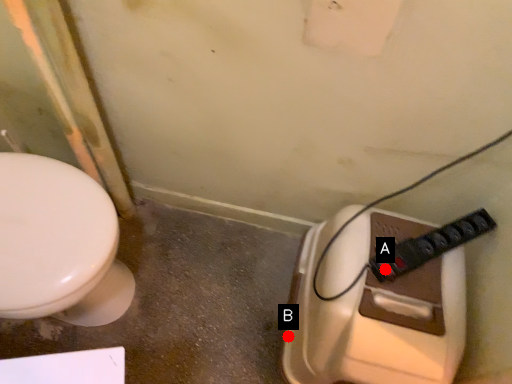
Question: Two points are circled on the image, labeled by A and B beside each circle. Which point is further to the camera?

Choices:
 (A) A is further
 (B) B is further

Answer: (B)